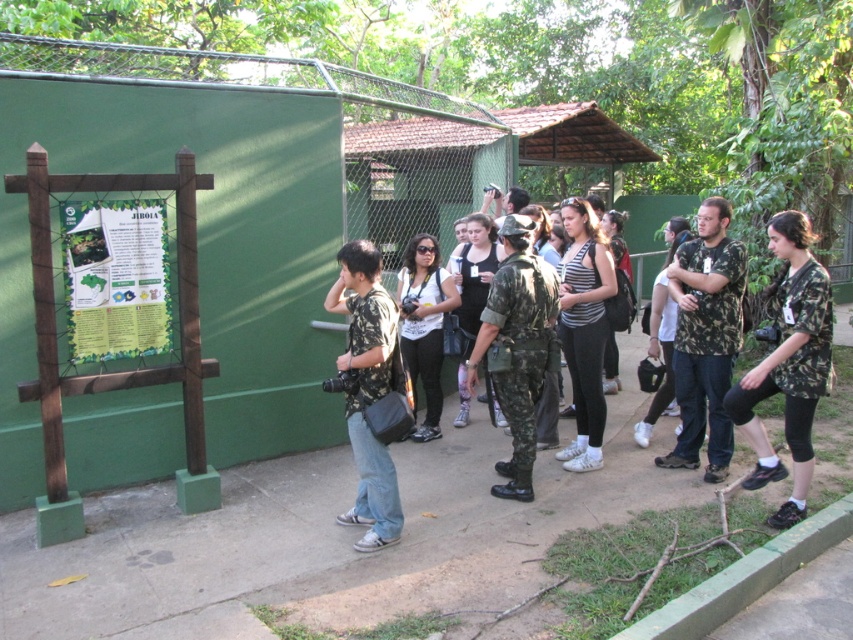
Is wooden signboard at left thinner than camouflage shirt at right?

No.

Which is above, wooden signboard at left or camouflage shirt at right?

wooden signboard at left is above.

Is point (181, 237) positioned behind point (740, 269)?

No.

This screenshot has height=640, width=853. What are the coordinates of `wooden signboard at left` in the screenshot? It's located at (115, 371).

Between green paper poster at left and camo uniform at center, which one appears on the right side from the viewer's perspective?

camo uniform at center is more to the right.

Who is shorter, green paper poster at left or camo uniform at center?

With less height is green paper poster at left.

What are the coordinates of `green paper poster at left` in the screenshot? It's located at (115, 278).

Which of these two, wooden signboard at left or camo-patterned shirt at center, stands shorter?

With less height is camo-patterned shirt at center.

This screenshot has height=640, width=853. Find the location of `wooden signboard at left`. wooden signboard at left is located at coordinates (115, 371).

This screenshot has height=640, width=853. What do you see at coordinates (115, 371) in the screenshot? I see `wooden signboard at left` at bounding box center [115, 371].

Where is `wooden signboard at left`? The height and width of the screenshot is (640, 853). wooden signboard at left is located at coordinates (115, 371).